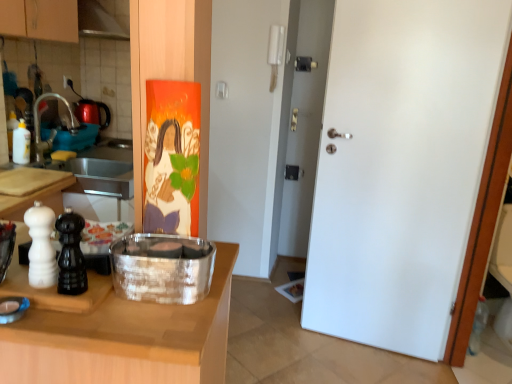
Question: Can you confirm if wooden cutting board at left, which appears as the 2th countertop when viewed from the top, is smaller than white glossy bottle at left?

Choices:
 (A) no
 (B) yes

Answer: (A)

Question: From a real-world perspective, is wooden cutting board at left, which appears as the 2th countertop when viewed from the top, positioned under white glossy bottle at left based on gravity?

Choices:
 (A) yes
 (B) no

Answer: (A)

Question: Considering the relative sizes of wooden cutting board at left, marked as the 1th countertop in a bottom-to-top arrangement, and white glossy bottle at left in the image provided, is wooden cutting board at left, marked as the 1th countertop in a bottom-to-top arrangement, shorter than white glossy bottle at left?

Choices:
 (A) no
 (B) yes

Answer: (A)

Question: Could you tell me if wooden cutting board at left, which appears as the 2th countertop when viewed from the top, is turned towards white glossy bottle at left?

Choices:
 (A) no
 (B) yes

Answer: (A)

Question: From the image's perspective, would you say wooden cutting board at left, which appears as the 2th countertop when viewed from the top, is shown under white glossy bottle at left?

Choices:
 (A) no
 (B) yes

Answer: (B)

Question: From the image's perspective, is brushed metal faucet at left located above or below silver metallic container at center?

Choices:
 (A) above
 (B) below

Answer: (A)

Question: Choose the correct answer: Is brushed metal faucet at left inside silver metallic container at center or outside it?

Choices:
 (A) inside
 (B) outside

Answer: (B)

Question: In terms of height, does brushed metal faucet at left look taller or shorter compared to silver metallic container at center?

Choices:
 (A) tall
 (B) short

Answer: (A)

Question: From a real-world perspective, relative to silver metallic container at center, is brushed metal faucet at left vertically above or below?

Choices:
 (A) below
 (B) above

Answer: (B)

Question: Is point (56, 94) closer or farther from the camera than point (133, 321)?

Choices:
 (A) farther
 (B) closer

Answer: (A)

Question: From the image's perspective, relative to wooden cutting board at left, marked as the 1th countertop in a bottom-to-top arrangement, is brushed metal faucet at left above or below?

Choices:
 (A) above
 (B) below

Answer: (A)

Question: In terms of width, does brushed metal faucet at left look wider or thinner when compared to wooden cutting board at left, marked as the 1th countertop in a bottom-to-top arrangement?

Choices:
 (A) thin
 (B) wide

Answer: (A)

Question: Is brushed metal faucet at left taller or shorter than wooden cutting board at left, which appears as the 2th countertop when viewed from the top?

Choices:
 (A) tall
 (B) short

Answer: (B)

Question: Visually, is wooden cutting board at left, marked as the second countertop in a bottom-to-top arrangement, positioned to the left or to the right of white glossy bottle at left?

Choices:
 (A) left
 (B) right

Answer: (B)

Question: Which is correct: wooden cutting board at left, marked as the second countertop in a bottom-to-top arrangement, is inside white glossy bottle at left, or outside of it?

Choices:
 (A) inside
 (B) outside

Answer: (B)